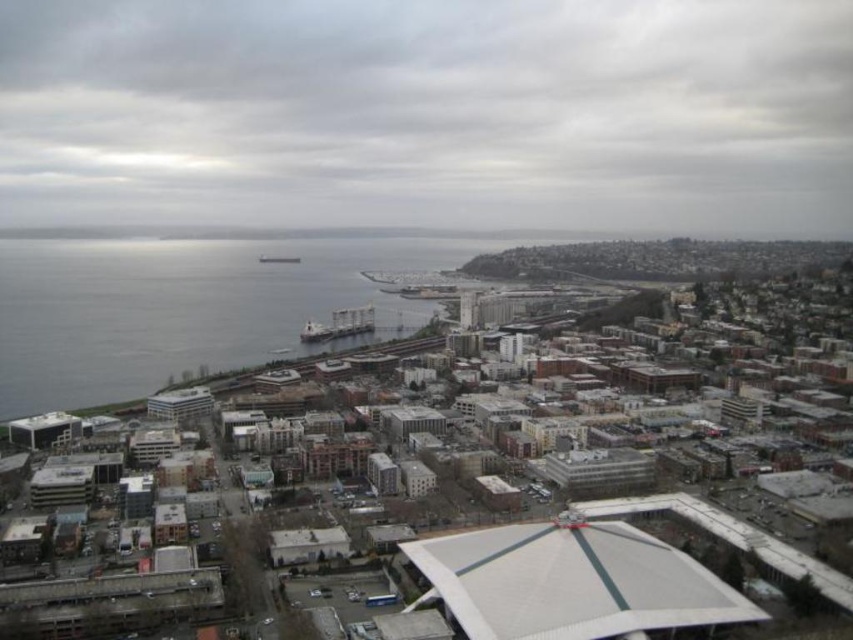
You are a pilot preparing to land your plane and notice the gray cloudy sky at upper center and the gray water at left in the distance. Which of these two elements occupies a bigger area in your view?

The gray cloudy sky at upper center has a larger size compared to the gray water at left, so it occupies a bigger area in your view.

Looking at this image, based on the scene description, where is the gray cloudy sky at upper center located in terms of coordinates?

The gray cloudy sky at upper center is located at coordinates point (428, 113).